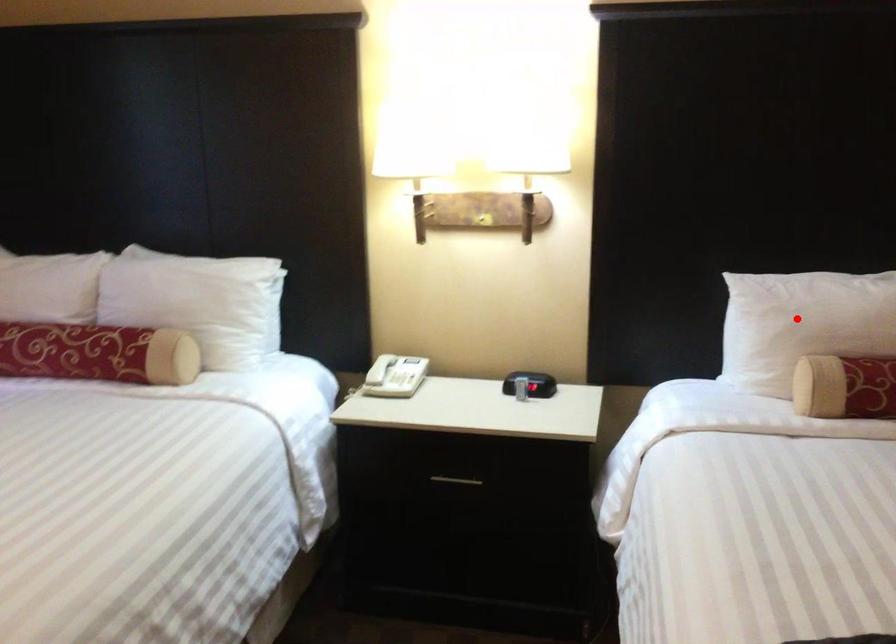
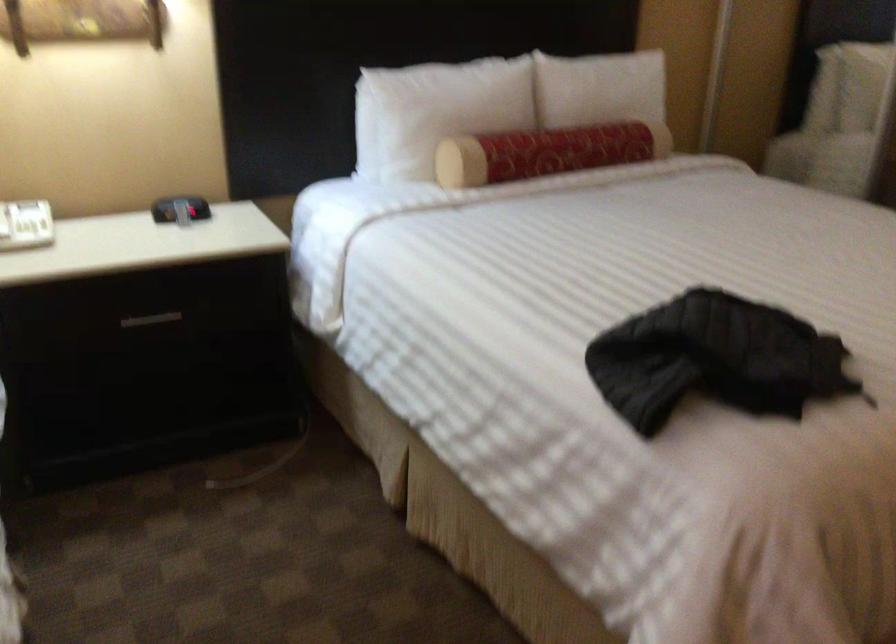
Question: I am providing you with two images of the same scene from different viewpoints. A red point is shown in image1. For the corresponding object point in image2, is it positioned nearer or farther from the camera?

Choices:
 (A) Nearer
 (B) Farther

Answer: (B)